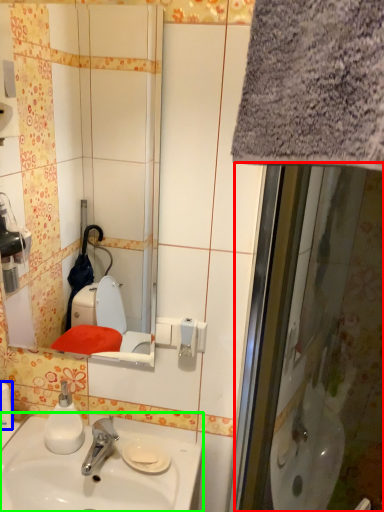
Question: Which object is the closest to the screen door (highlighted by a red box)? Choose among these: toiletry (highlighted by a blue box) or sink (highlighted by a green box).

Choices:
 (A) toiletry
 (B) sink

Answer: (B)